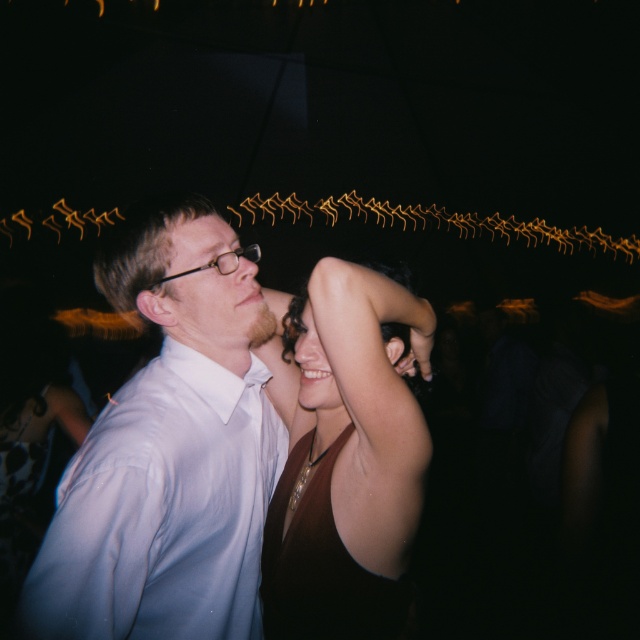
You are a photographer setting up for a group photo. You need to ensure that the matte white face at center and the satin burgundy dress at center are both clearly visible in the frame. Considering their positions, which object might require more space to capture fully?

The satin burgundy dress at center might be wider than the matte white face at center, so it might require more space to capture fully.

Consider the image. You are standing in the center of the room and want to locate the white glossy shirt at center. Based on the coordinates provided, in which direction should you look to find it?

The white glossy shirt at center is located at coordinates point (168, 456), so you should look to the lower right direction from your current position to find it.